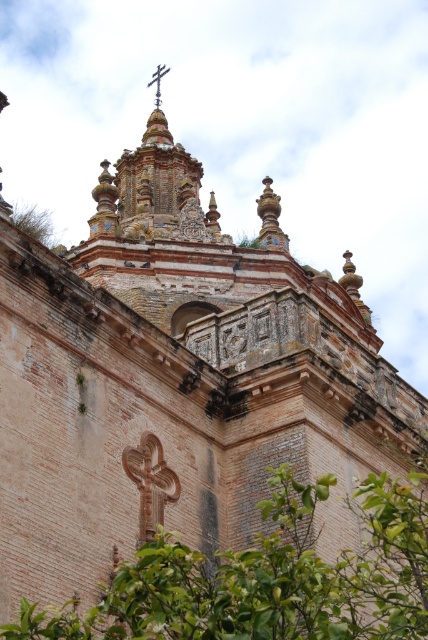
You are standing in front of the historic building and notice two points marked on the facade. The first point is at coordinates point (422, 508) and the second is at point (14, 225). Which of these two points is nearer to your current position?

Point (422, 508) is closer to the viewer than point (14, 225).